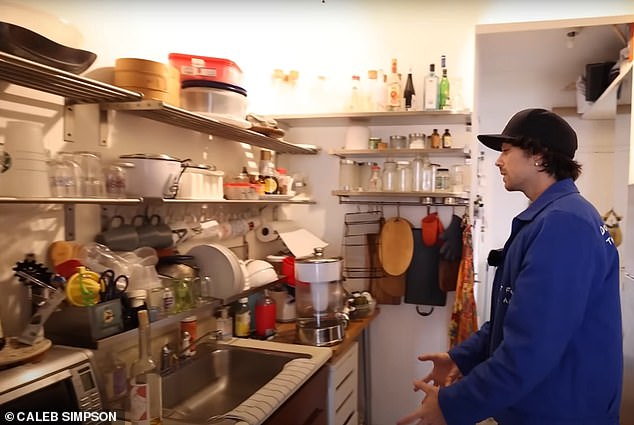
Where is `towel`? This screenshot has width=634, height=425. towel is located at coordinates (264, 395).